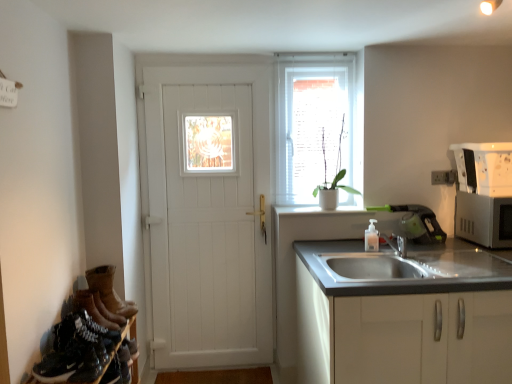
Question: Is silver metallic microwave at right far from brown suede boots at lower left?

Choices:
 (A) no
 (B) yes

Answer: (B)

Question: Can you confirm if silver metallic microwave at right is smaller than brown suede boots at lower left?

Choices:
 (A) yes
 (B) no

Answer: (B)

Question: Is silver metallic microwave at right bigger than brown suede boots at lower left?

Choices:
 (A) yes
 (B) no

Answer: (A)

Question: Could brown suede boots at lower left be considered to be inside silver metallic microwave at right?

Choices:
 (A) no
 (B) yes

Answer: (A)

Question: Can you confirm if silver metallic microwave at right is positioned to the right of brown suede boots at lower left?

Choices:
 (A) yes
 (B) no

Answer: (A)

Question: Considering the positions of white matte cabinet at lower right and white wooden door at center in the image, is white matte cabinet at lower right taller or shorter than white wooden door at center?

Choices:
 (A) short
 (B) tall

Answer: (A)

Question: From the image's perspective, is white matte cabinet at lower right located above or below white wooden door at center?

Choices:
 (A) below
 (B) above

Answer: (A)

Question: Is point (410, 344) closer or farther from the camera than point (242, 140)?

Choices:
 (A) farther
 (B) closer

Answer: (B)

Question: Looking at their shapes, would you say white matte cabinet at lower right is wider or thinner than white wooden door at center?

Choices:
 (A) thin
 (B) wide

Answer: (B)

Question: From the image's perspective, is white wooden door at center above or below white plastic electric outlet at upper right?

Choices:
 (A) above
 (B) below

Answer: (B)

Question: In terms of size, does white wooden door at center appear bigger or smaller than white plastic electric outlet at upper right?

Choices:
 (A) small
 (B) big

Answer: (B)

Question: Is point (238, 218) positioned closer to the camera than point (431, 175)?

Choices:
 (A) closer
 (B) farther

Answer: (B)

Question: Considering their positions, is white wooden door at center located in front of or behind white plastic electric outlet at upper right?

Choices:
 (A) front
 (B) behind

Answer: (A)

Question: In the image, is silver metallic microwave at right positioned in front of or behind white glossy window sill at center?

Choices:
 (A) front
 (B) behind

Answer: (A)

Question: Looking at their shapes, would you say silver metallic microwave at right is wider or thinner than white glossy window sill at center?

Choices:
 (A) wide
 (B) thin

Answer: (A)